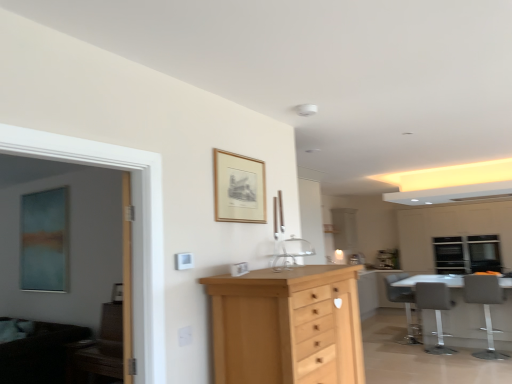
This screenshot has width=512, height=384. In order to click on clear glass sink at center in this screenshot , I will do `click(291, 253)`.

In order to face transparent glass window at upper right, should I rotate leftwards or rightwards?

Rotate right and turn 28.295 degrees.

The width and height of the screenshot is (512, 384). What do you see at coordinates (451, 230) in the screenshot? I see `white glossy cabinetry at right` at bounding box center [451, 230].

What do you see at coordinates (239, 188) in the screenshot? This screenshot has width=512, height=384. I see `wooden picture frame at upper center` at bounding box center [239, 188].

Where is `white glossy table at lower right`? The width and height of the screenshot is (512, 384). white glossy table at lower right is located at coordinates [456, 312].

In terms of width, does transparent glass window at upper right look wider or thinner when compared to gray fabric chair at lower right, placed as the 3th chair when sorted from back to front?

In the image, transparent glass window at upper right appears to be more narrow than gray fabric chair at lower right, placed as the 3th chair when sorted from back to front.

Is transparent glass window at upper right with gray fabric chair at lower right, the first chair from the front?

No, transparent glass window at upper right is not next to gray fabric chair at lower right, the first chair from the front.

Considering the positions of objects transparent glass window at upper right and gray fabric chair at lower right, placed as the 3th chair when sorted from back to front, in the image provided, who is behind, transparent glass window at upper right or gray fabric chair at lower right, placed as the 3th chair when sorted from back to front,?

transparent glass window at upper right is more distant.

Could you measure the distance between transparent glass window at upper right and gray fabric chair at lower right, the first chair from the front?

transparent glass window at upper right and gray fabric chair at lower right, the first chair from the front, are 3.58 feet apart.

Who is more distant, gray fabric chair at right, the 1th chair from the back, or transparent glass window at upper right?

Positioned behind is transparent glass window at upper right.

Considering the points (420, 342) and (471, 257), which point is behind, point (420, 342) or point (471, 257)?

The point (471, 257) is behind.

Considering the relative sizes of gray fabric chair at right, the 1th chair from the back, and transparent glass window at upper right in the image provided, is gray fabric chair at right, the 1th chair from the back, wider than transparent glass window at upper right?

Yes.

Which of these two, gray fabric chair at lower right, the first chair from the front, or white glossy cabinetry at right, stands taller?

white glossy cabinetry at right.

Which is in front, gray fabric chair at lower right, placed as the 3th chair when sorted from back to front, or white glossy cabinetry at right?

Positioned in front is gray fabric chair at lower right, placed as the 3th chair when sorted from back to front.

There is a gray fabric chair at lower right, the first chair from the front. Where is `cabinetry above it (from a real-world perspective)`? cabinetry above it (from a real-world perspective) is located at coordinates (451, 230).

Between gray fabric chair at lower right, placed as the 3th chair when sorted from back to front, and white glossy cabinetry at right, which one has smaller width?

Thinner between the two is gray fabric chair at lower right, placed as the 3th chair when sorted from back to front.

Can you tell me how much wooden picture frame at upper center and white glossy cabinetry at right differ in facing direction?

There is a 89.6-degree angle between the facing directions of wooden picture frame at upper center and white glossy cabinetry at right.

Relative to white glossy cabinetry at right, is wooden picture frame at upper center in front or behind?

Clearly, wooden picture frame at upper center is in front of white glossy cabinetry at right.

Would you consider wooden picture frame at upper center to be distant from white glossy cabinetry at right?

Yes, wooden picture frame at upper center is far from white glossy cabinetry at right.

Is wooden picture frame at upper center positioned beyond the bounds of white glossy cabinetry at right?

Yes, wooden picture frame at upper center is not within white glossy cabinetry at right.

Is white glossy table at lower right positioned beyond the bounds of light wood chest of drawers at center?

Indeed, white glossy table at lower right is completely outside light wood chest of drawers at center.

Which is closer, [509,324] or [268,295]?

Point [268,295]

Can you confirm if white glossy table at lower right is bigger than light wood chest of drawers at center?

Indeed, white glossy table at lower right has a larger size compared to light wood chest of drawers at center.

How many degrees apart are the facing directions of white glossy table at lower right and light wood chest of drawers at center?

The angular difference between white glossy table at lower right and light wood chest of drawers at center is 89 degrees.

Is white glossy table at lower right looking in the opposite direction of gray fabric chair at right, the 1th chair from the back?

white glossy table at lower right does not have its back to gray fabric chair at right, the 1th chair from the back.

Considering the relative positions of white glossy table at lower right and gray fabric chair at right, the 1th chair from the back, in the image provided, is white glossy table at lower right to the right of gray fabric chair at right, the 1th chair from the back, from the viewer's perspective?

Correct, you'll find white glossy table at lower right to the right of gray fabric chair at right, the 1th chair from the back.

Is the depth of white glossy table at lower right less than that of gray fabric chair at right, the 1th chair from the back?

Yes, it is.

Is white glossy table at lower right wider than gray fabric chair at right, the 1th chair from the back?

Correct, the width of white glossy table at lower right exceeds that of gray fabric chair at right, the 1th chair from the back.

From a real-world perspective, is white glossy cabinetry at right beneath white glossy table at lower right?

No.

Who is smaller, white glossy cabinetry at right or white glossy table at lower right?

white glossy cabinetry at right is smaller.

Is white glossy cabinetry at right positioned in front of white glossy table at lower right?

No, it is behind white glossy table at lower right.

Is white glossy table at lower right a part of white glossy cabinetry at right?

No, white glossy table at lower right is located outside of white glossy cabinetry at right.

I want to click on the 1st chair to the left of the transparent glass window at upper right, starting your count from the anchor, so click(485, 307).

The height and width of the screenshot is (384, 512). Identify the location of window behind the gray fabric chair at right, the 1th chair from the back. (484, 253).

Considering their positions, is gray fabric chair at lower right, the first chair from the front, positioned closer to light wood chest of drawers at center than wooden picture frame at upper center?

wooden picture frame at upper center.

When comparing their distances from transparent glass window at upper right, does clear glass sink at center or gray fabric chair at lower right, placed as the 3th chair when sorted from back to front, seem closer?

Based on the image, gray fabric chair at lower right, placed as the 3th chair when sorted from back to front, appears to be nearer to transparent glass window at upper right.

From the image, which object appears to be farther from transparent glass window at upper right, white glossy cabinetry at right or gray fabric chair at right, the 1th chair from the back?

gray fabric chair at right, the 1th chair from the back, is further to transparent glass window at upper right.

When comparing their distances from light wood chest of drawers at center, does matte gray chair at lower right, arranged as the 2th chair when viewed from the front, or wooden picture frame at upper center seem closer?

Based on the image, wooden picture frame at upper center appears to be nearer to light wood chest of drawers at center.

Based on the photo, which object lies nearer to the anchor point matte gray chair at lower right, placed as the 2th chair when sorted from back to front, transparent glass window at upper right or gray fabric chair at right, the 1th chair from the back?

gray fabric chair at right, the 1th chair from the back, is positioned closer to the anchor matte gray chair at lower right, placed as the 2th chair when sorted from back to front.

Estimate the real-world distances between objects in this image. Which object is further from white glossy cabinetry at right, clear glass sink at center or wooden picture frame at upper center?

Among the two, wooden picture frame at upper center is located further to white glossy cabinetry at right.

Based on their spatial positions, is white glossy table at lower right or wooden picture frame at upper center closer to light wood chest of drawers at center?

Based on the image, wooden picture frame at upper center appears to be nearer to light wood chest of drawers at center.

From the image, which object appears to be farther from light wood chest of drawers at center, gray fabric chair at lower right, the first chair from the front, or gray fabric chair at right, the 1th chair from the back?

gray fabric chair at right, the 1th chair from the back, lies further to light wood chest of drawers at center than the other object.

Locate an element on the screen. Image resolution: width=512 pixels, height=384 pixels. sink positioned between light wood chest of drawers at center and gray fabric chair at right, the 1th chair from the back, from near to far is located at coordinates (291, 253).

Locate an element on the screen. sink positioned between light wood chest of drawers at center and white glossy table at lower right from near to far is located at coordinates (291, 253).

Where is `table between clear glass sink at center and white glossy cabinetry at right from front to back`? The image size is (512, 384). table between clear glass sink at center and white glossy cabinetry at right from front to back is located at coordinates (456, 312).

You are a GUI agent. You are given a task and a screenshot of the screen. Output one action in this format:
    pyautogui.click(x=<x>, y=<y>)
    Task: Click on the sink situated between wooden picture frame at upper center and white glossy table at lower right from left to right
    The image size is (512, 384).
    Given the screenshot: What is the action you would take?
    pyautogui.click(x=291, y=253)